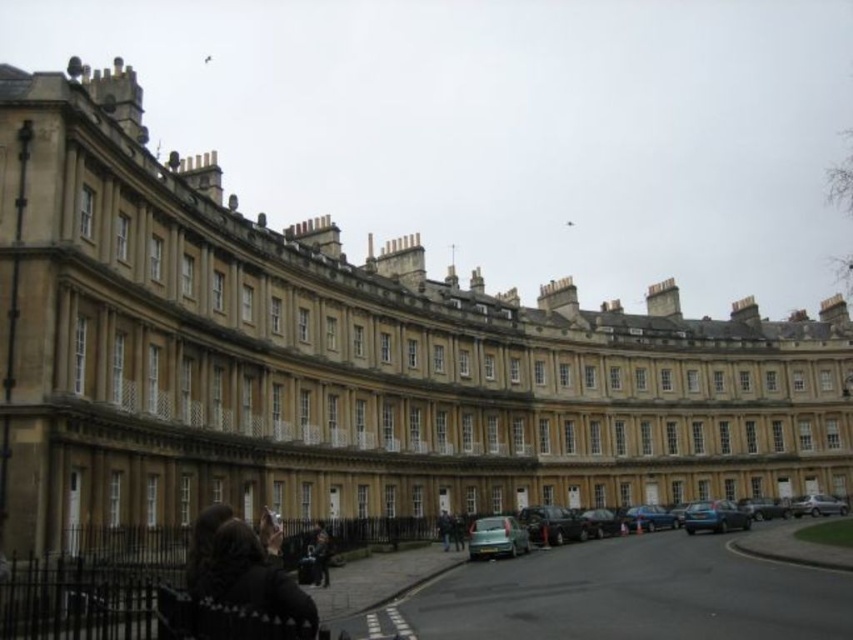
Question: Among these points, which one is nearest to the camera?

Choices:
 (A) (584, 525)
 (B) (828, 497)
 (C) (567, 515)
 (D) (445, 529)

Answer: (D)

Question: Which object is closer to the camera taking this photo?

Choices:
 (A) blue metallic car at lower right
 (B) matte black car at center
 (C) shiny black car at center

Answer: (B)

Question: Estimate the real-world distances between objects in this image. Which object is farther from the silver metallic car at lower right?

Choices:
 (A) shiny black car at center
 (B) dark brown leather jacket at lower left

Answer: (B)

Question: Can you confirm if dark brown leather jacket at lower left is positioned to the right of silver metallic car at lower right?

Choices:
 (A) yes
 (B) no

Answer: (B)

Question: Is shiny blue sedan at lower right thinner than dark brown leather jacket at center?

Choices:
 (A) no
 (B) yes

Answer: (A)

Question: Considering the relative positions of matte black car at center and dark brown leather jacket at center in the image provided, where is matte black car at center located with respect to dark brown leather jacket at center?

Choices:
 (A) right
 (B) left

Answer: (A)